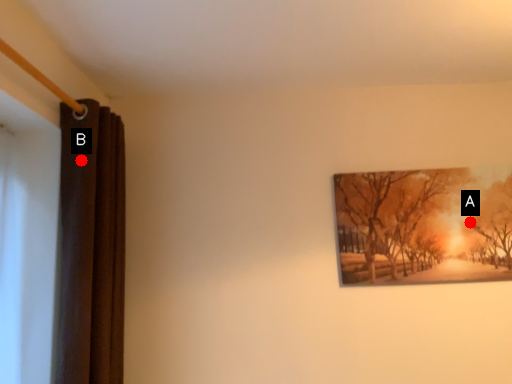
Question: Two points are circled on the image, labeled by A and B beside each circle. Which point is further to the camera?

Choices:
 (A) A is further
 (B) B is further

Answer: (A)